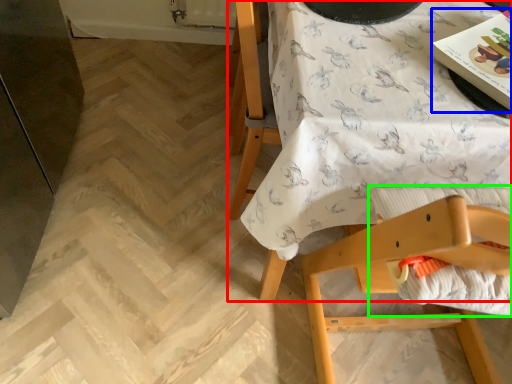
Question: Based on their relative distances, which object is nearer to table (highlighted by a red box)? Choose from magazine (highlighted by a blue box) and sheet (highlighted by a green box).

Choices:
 (A) magazine
 (B) sheet

Answer: (B)